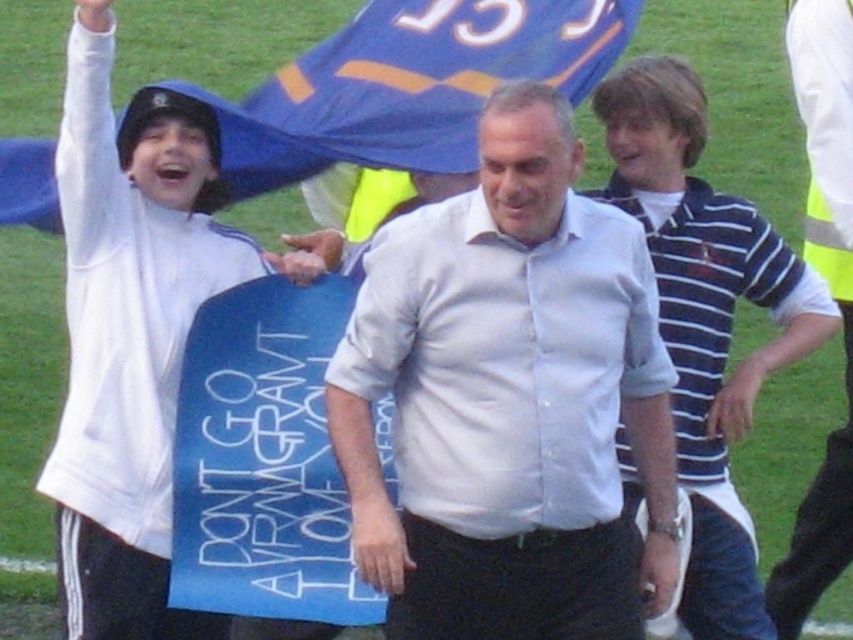
Question: Does blue striped polo shirt at center lie in front of blue fabric flag at upper center?

Choices:
 (A) no
 (B) yes

Answer: (A)

Question: Which point appears farthest from the camera in this image?

Choices:
 (A) (502, 51)
 (B) (590, 400)
 (C) (804, 118)
 (D) (82, 467)

Answer: (C)

Question: Can you confirm if white cotton shirt at center is positioned above blue striped polo shirt at center?

Choices:
 (A) yes
 (B) no

Answer: (B)

Question: Which object appears farthest from the camera in this image?

Choices:
 (A) white cotton shirt at center
 (B) white striped polo shirt at right
 (C) blue striped polo shirt at center
 (D) blue fabric flag at upper center

Answer: (B)

Question: Does blue fabric flag at upper center come in front of white striped polo shirt at right?

Choices:
 (A) yes
 (B) no

Answer: (A)

Question: Among these points, which one is farthest from the camera?

Choices:
 (A) (686, 593)
 (B) (569, 300)

Answer: (A)